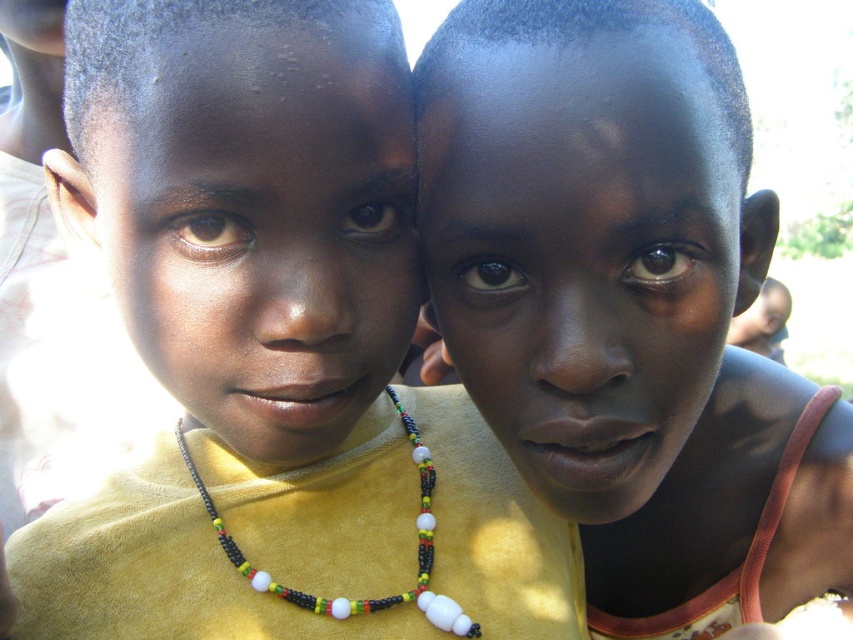
Question: Is yellow fabric shirt at center positioned in front of beaded necklace at center?

Choices:
 (A) yes
 (B) no

Answer: (A)

Question: Which of the following is the closest to the observer?

Choices:
 (A) yellow fabric shirt at center
 (B) yellow matte shirt at center
 (C) beaded necklace at center

Answer: (B)

Question: Can you confirm if yellow fabric shirt at center is thinner than beaded necklace at center?

Choices:
 (A) yes
 (B) no

Answer: (B)

Question: Among these points, which one is farthest from the camera?

Choices:
 (A) (405, 413)
 (B) (277, 216)

Answer: (A)

Question: Is yellow matte shirt at center bigger than yellow fabric shirt at center?

Choices:
 (A) no
 (B) yes

Answer: (B)

Question: Which point is farther to the camera?

Choices:
 (A) yellow matte shirt at center
 (B) beaded necklace at center
 (C) yellow fabric shirt at center

Answer: (B)